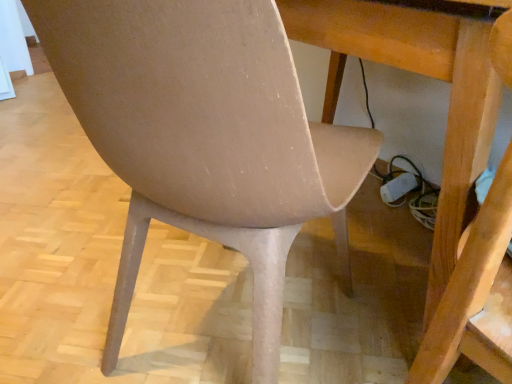
Find the location of `vacant position to the left of matte beige chair at center`. vacant position to the left of matte beige chair at center is located at coordinates 78,287.